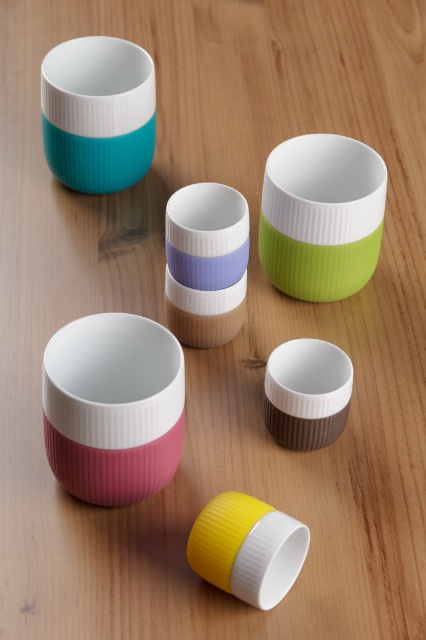
Question: Which object is closer to the camera taking this photo?

Choices:
 (A) green matte cup at center
 (B) matte pink bowl at lower left
 (C) teal matte cup at upper left
 (D) yellow matte cup at lower center

Answer: (D)

Question: Which object is farther from the camera taking this photo?

Choices:
 (A) matte pink bowl at lower left
 (B) brown matte cup at center
 (C) teal matte cup at upper left

Answer: (C)

Question: Based on their relative distances, which object is farther from the yellow matte cup at lower center?

Choices:
 (A) brown matte cup at center
 (B) matte pink bowl at lower left
 (C) teal matte cup at upper left
 (D) green matte cup at center

Answer: (C)

Question: Does yellow matte cup at lower center appear on the right side of brown matte cup at center?

Choices:
 (A) yes
 (B) no

Answer: (B)

Question: Does teal matte cup at upper left appear on the right side of yellow matte cup at lower center?

Choices:
 (A) yes
 (B) no

Answer: (B)

Question: Does matte pink bowl at lower left come behind green matte cup at center?

Choices:
 (A) no
 (B) yes

Answer: (A)